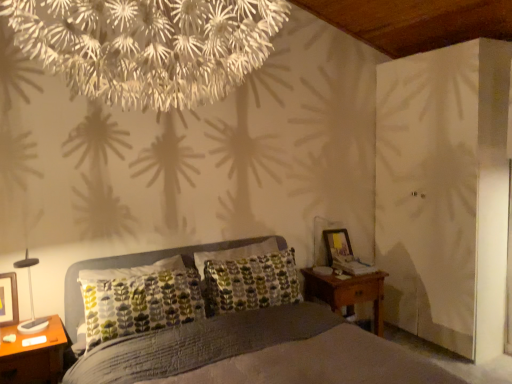
Question: Is textured gray bed at center looking in the opposite direction of wooden nightstand at lower left, the second nightstand in the right-to-left sequence?

Choices:
 (A) no
 (B) yes

Answer: (A)

Question: Could you tell me if textured gray bed at center is turned towards wooden nightstand at lower left, which is the 1th nightstand in left-to-right order?

Choices:
 (A) yes
 (B) no

Answer: (B)

Question: Does textured gray bed at center have a lesser height compared to wooden nightstand at lower left, which is the 1th nightstand in left-to-right order?

Choices:
 (A) yes
 (B) no

Answer: (B)

Question: From a real-world perspective, is textured gray bed at center below wooden nightstand at lower left, positioned as the 2th nightstand in back-to-front order?

Choices:
 (A) yes
 (B) no

Answer: (B)

Question: Is textured gray bed at center surrounding wooden nightstand at lower left, which is the 1th nightstand in left-to-right order?

Choices:
 (A) no
 (B) yes

Answer: (B)

Question: From a real-world perspective, is wooden nightstand at lower left, acting as the 1th nightstand starting from the front, physically located above or below wooden nightstand at right, which appears as the second nightstand when viewed from the left?

Choices:
 (A) above
 (B) below

Answer: (A)

Question: Considering the positions of wooden nightstand at lower left, which is the 1th nightstand in left-to-right order, and wooden nightstand at right, the 1th nightstand from the back, in the image, is wooden nightstand at lower left, which is the 1th nightstand in left-to-right order, bigger or smaller than wooden nightstand at right, the 1th nightstand from the back,?

Choices:
 (A) big
 (B) small

Answer: (B)

Question: Is point (44, 362) positioned closer to the camera than point (313, 274)?

Choices:
 (A) farther
 (B) closer

Answer: (B)

Question: Considering their positions, is wooden nightstand at lower left, positioned as the 2th nightstand in back-to-front order, located in front of or behind wooden nightstand at right, which appears as the second nightstand when viewed from the left?

Choices:
 (A) front
 (B) behind

Answer: (A)

Question: Is point (29, 263) closer or farther from the camera than point (352, 297)?

Choices:
 (A) farther
 (B) closer

Answer: (B)

Question: Which is correct: matte black lamp at left is inside wooden nightstand at right, which appears as the second nightstand when viewed from the left, or outside of it?

Choices:
 (A) outside
 (B) inside

Answer: (A)

Question: From the image's perspective, is matte black lamp at left above or below wooden nightstand at right, which appears as the second nightstand when viewed from the left?

Choices:
 (A) above
 (B) below

Answer: (A)

Question: From a real-world perspective, relative to wooden nightstand at right, which is the second nightstand from front to back, is matte black lamp at left vertically above or below?

Choices:
 (A) above
 (B) below

Answer: (A)

Question: Is wooden nightstand at lower left, which is the 1th nightstand in left-to-right order, in front of or behind white textured chandelier at upper center in the image?

Choices:
 (A) front
 (B) behind

Answer: (B)

Question: From a real-world perspective, relative to white textured chandelier at upper center, is wooden nightstand at lower left, the second nightstand in the right-to-left sequence, vertically above or below?

Choices:
 (A) above
 (B) below

Answer: (B)